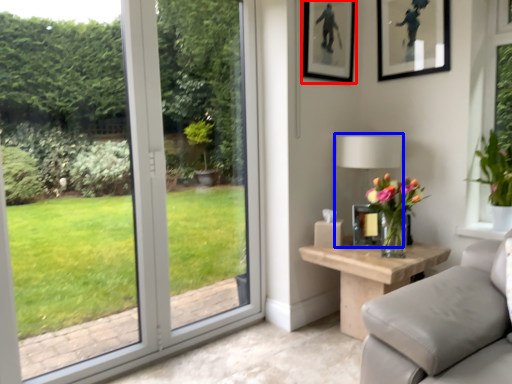
Question: Among these objects, which one is nearest to the camera, picture frame (highlighted by a red box) or table lamp (highlighted by a blue box)?

Choices:
 (A) picture frame
 (B) table lamp

Answer: (B)